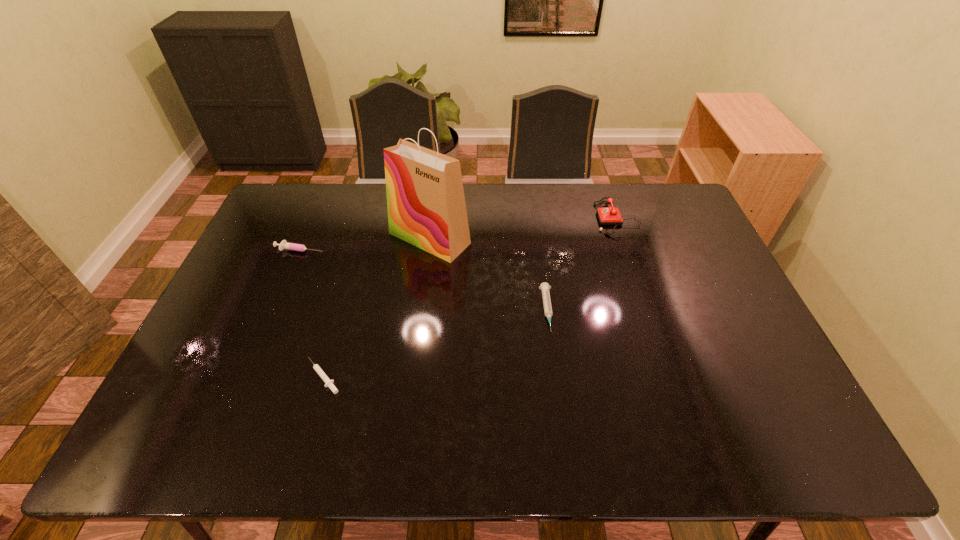
At what (x,y) coordinates should I click in order to perform the action: click on free space at the far edge of the desktop. Please return your answer as a coordinate pair (x, y). Looking at the image, I should click on (492, 212).

The height and width of the screenshot is (540, 960). What are the coordinates of `free space at the left edge` in the screenshot? It's located at (269, 292).

At what (x,y) coordinates should I click in order to perform the action: click on vacant point at the right edge. Please return your answer as a coordinate pair (x, y). The image size is (960, 540). Looking at the image, I should click on (727, 314).

The width and height of the screenshot is (960, 540). In the image, there is a desktop. What are the coordinates of `free space at the near left corner` in the screenshot? It's located at (156, 433).

Locate an element on the screen. Image resolution: width=960 pixels, height=540 pixels. free space at the near right corner is located at coordinates (766, 438).

In order to click on vacant point located between the fourth shortest object and the shopping bag in this screenshot , I will do `click(523, 228)`.

You are a GUI agent. You are given a task and a screenshot of the screen. Output one action in this format:
    pyautogui.click(x=<x>, y=<y>)
    Task: Click on the unoccupied position between the leftmost object and the shopping bag
    The width and height of the screenshot is (960, 540).
    Given the screenshot: What is the action you would take?
    pyautogui.click(x=365, y=244)

This screenshot has width=960, height=540. I want to click on vacant area that lies between the fourth shortest object and the fourth object from right to left, so click(470, 298).

Identify the location of free point between the rightmost object and the third object from right to left. The image size is (960, 540). (523, 228).

Identify the location of blank region between the telephone and the fourth object from left to right. point(583,264).